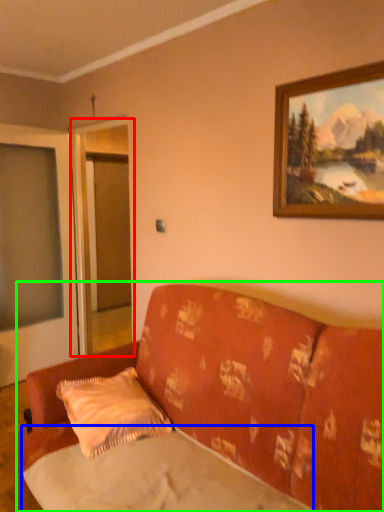
Question: Estimate the real-world distances between objects in this image. Which object is closer to screen door (highlighted by a red box), sheet (highlighted by a blue box) or studio couch (highlighted by a green box)?

Choices:
 (A) sheet
 (B) studio couch

Answer: (B)